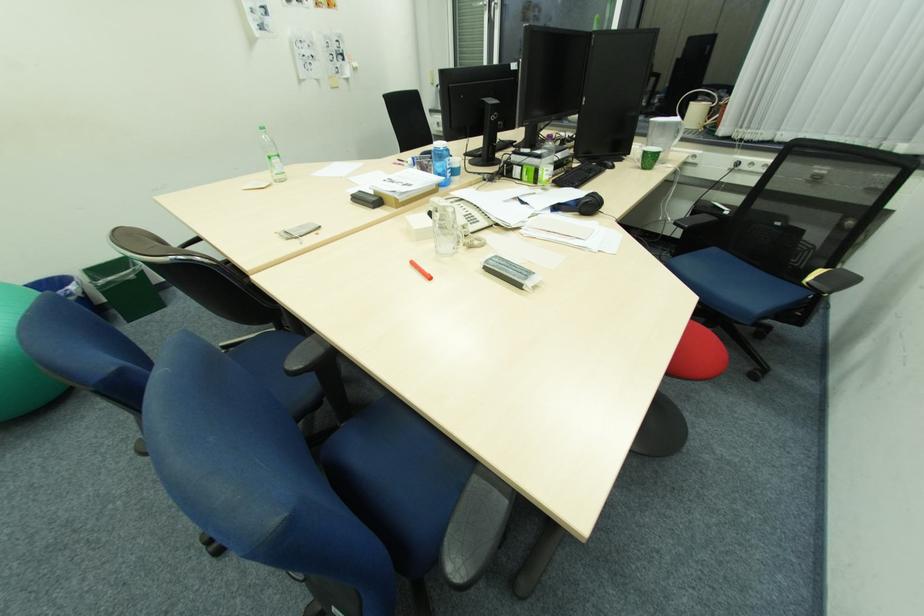
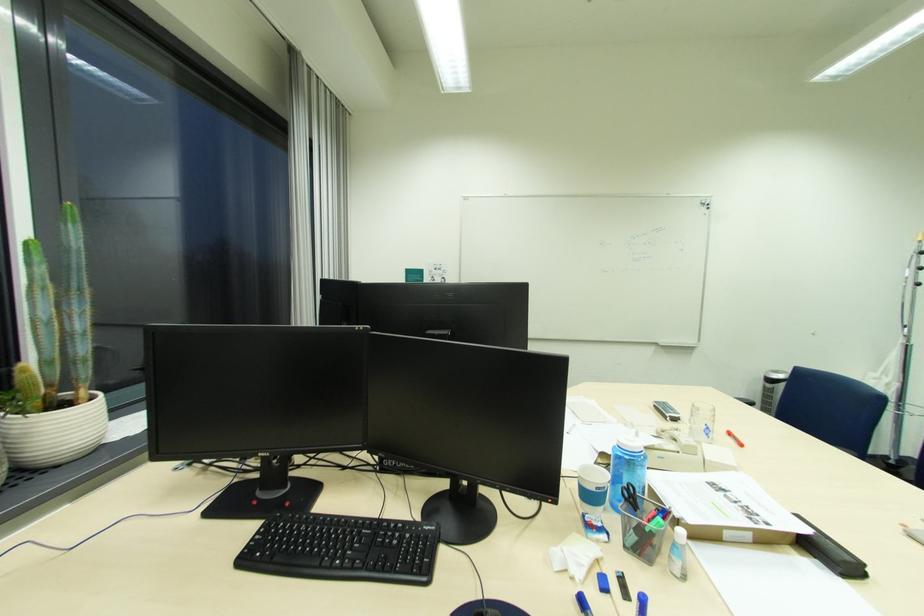
Find the pixel in the second image that matches point 409,185 in the first image.

(731, 491)